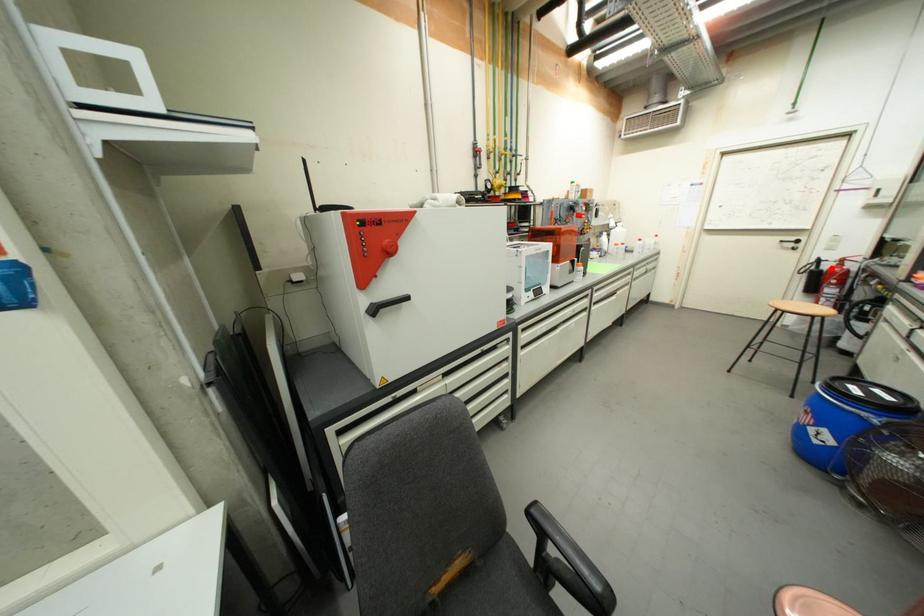
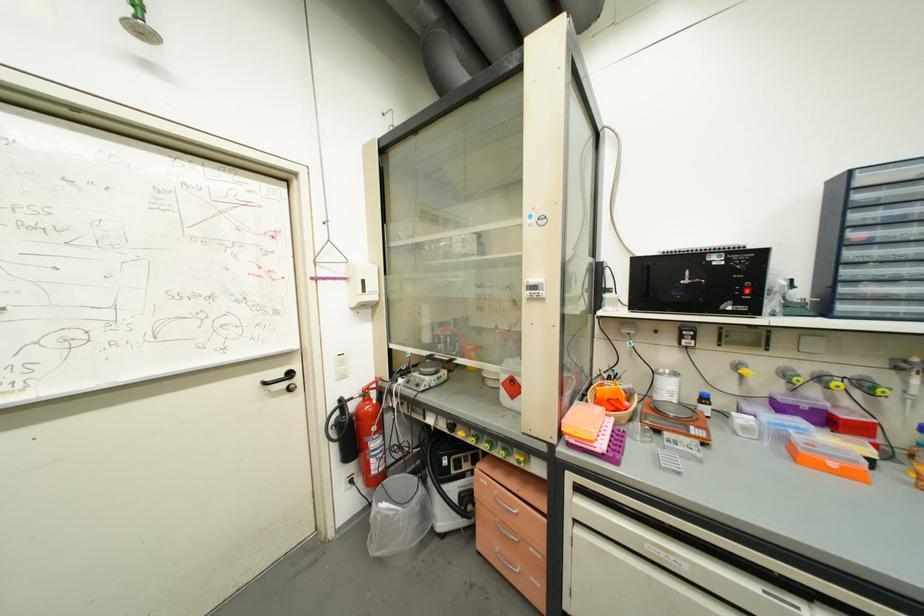
Find the pixel in the second image that matches the highlighted location in the first image.

(358, 408)